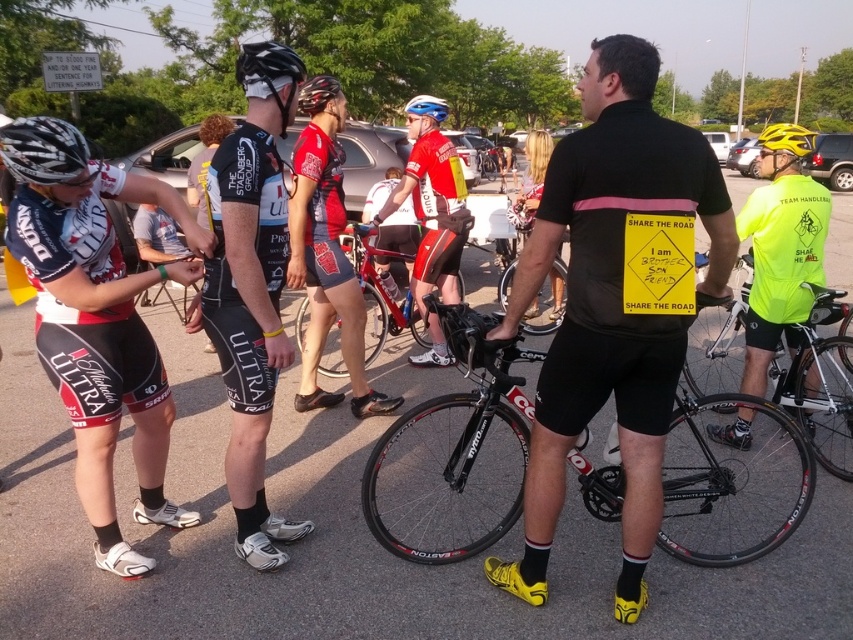
Question: Does black matte bicycle at center have a smaller size compared to matte black bicycle at center?

Choices:
 (A) no
 (B) yes

Answer: (A)

Question: Estimate the real-world distances between objects in this image. Which object is farther from the black matte jersey at center?

Choices:
 (A) matte black cycling jersey at center
 (B) black matte helmet at upper center

Answer: (B)

Question: Does black matte bicycle at center come in front of black matte helmet at upper center?

Choices:
 (A) no
 (B) yes

Answer: (B)

Question: Which object is the farthest from the black matte jersey at center?

Choices:
 (A) black matte helmet at upper center
 (B) matte black helmet at upper left
 (C) red/white jersey at center
 (D) shiny black frame at center

Answer: (D)

Question: Can you confirm if black matte jersey at center is smaller than matte black helmet at upper left?

Choices:
 (A) yes
 (B) no

Answer: (B)

Question: Which of the following is the closest to the observer?

Choices:
 (A) matte black helmet at upper left
 (B) shiny black helmet at center
 (C) shiny black frame at center
 (D) black matte helmet at upper center

Answer: (A)